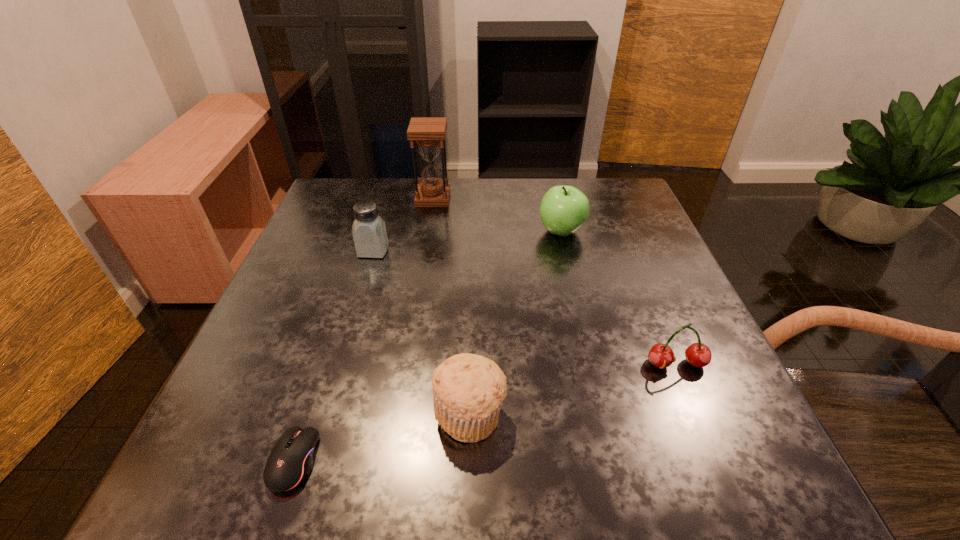
Where is `vacant space located 0.080m on the right of the saltshaker`? This screenshot has width=960, height=540. vacant space located 0.080m on the right of the saltshaker is located at coordinates (423, 251).

The width and height of the screenshot is (960, 540). In order to click on vacant space situated on the back of the muffin in this screenshot , I will do `click(473, 239)`.

Locate an element on the screen. This screenshot has width=960, height=540. free space located with stems pointing upwards on the rightmost object is located at coordinates (709, 443).

Locate an element on the screen. This screenshot has width=960, height=540. free space located on the back of the computer mouse is located at coordinates (330, 348).

The width and height of the screenshot is (960, 540). What are the coordinates of `hourglass that is positioned at the far edge` in the screenshot? It's located at (428, 132).

The image size is (960, 540). In order to click on apple that is at the far edge in this screenshot , I will do `click(564, 209)`.

Identify the location of muffin present at the near edge. Image resolution: width=960 pixels, height=540 pixels. (468, 390).

You are a GUI agent. You are given a task and a screenshot of the screen. Output one action in this format:
    pyautogui.click(x=<x>, y=<y>)
    Task: Click on the computer mouse that is at the near edge
    
    Given the screenshot: What is the action you would take?
    pyautogui.click(x=290, y=462)

You are a GUI agent. You are given a task and a screenshot of the screen. Output one action in this format:
    pyautogui.click(x=<x>, y=<y>)
    Task: Click on the saltshaker situated at the left edge
    
    Given the screenshot: What is the action you would take?
    pyautogui.click(x=369, y=232)

I want to click on computer mouse located at the left edge, so click(x=290, y=462).